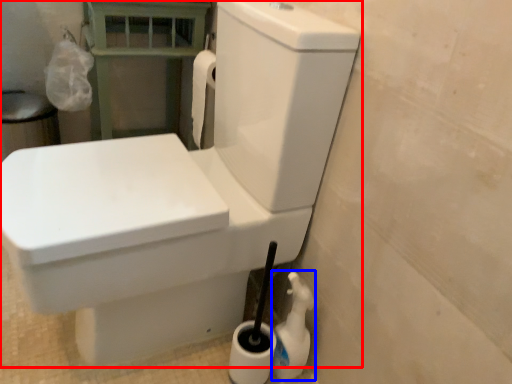
Question: Which point is further to the camera, toilet (highlighted by a red box) or cleaning product (highlighted by a blue box)?

Choices:
 (A) toilet
 (B) cleaning product

Answer: (B)